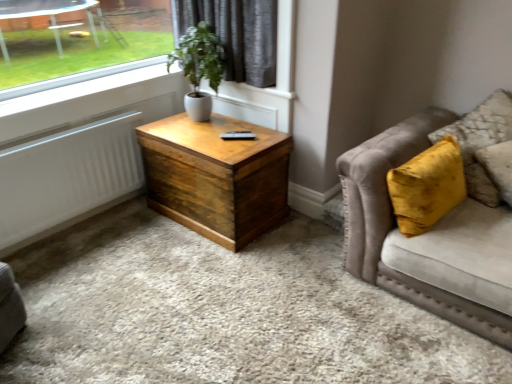
Locate an element on the screen. free space above wooden chest at center (from a real-world perspective) is located at coordinates (219, 134).